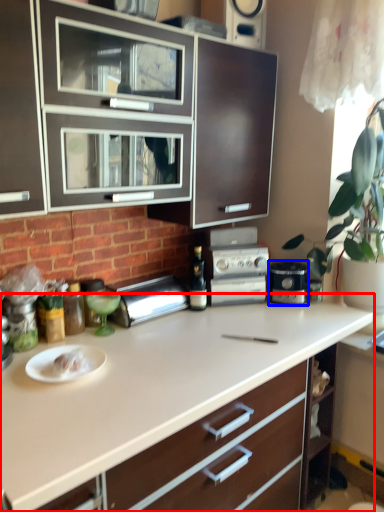
Question: Which of the following is the closest to the observer, countertop (highlighted by a red box) or home appliance (highlighted by a blue box)?

Choices:
 (A) countertop
 (B) home appliance

Answer: (A)